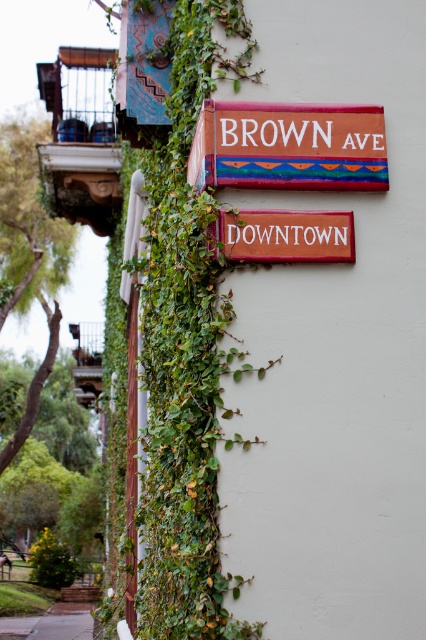
Question: Is painted wood sign at upper center to the left of red wood downtown sign at center from the viewer's perspective?

Choices:
 (A) no
 (B) yes

Answer: (A)

Question: Does painted wood sign at upper center lie behind red wood downtown sign at center?

Choices:
 (A) no
 (B) yes

Answer: (B)

Question: Can you confirm if painted wood sign at upper center is wider than red wood downtown sign at center?

Choices:
 (A) no
 (B) yes

Answer: (B)